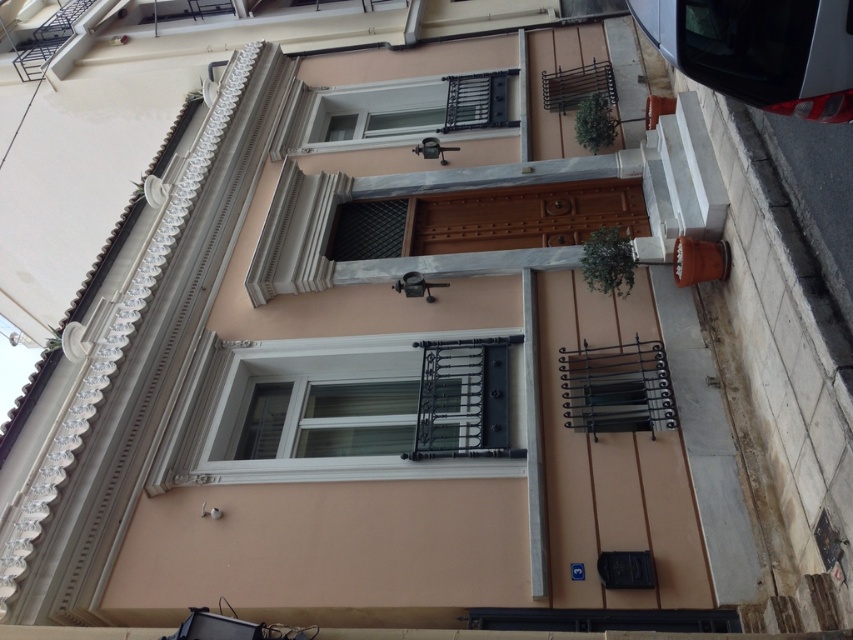
Is white matte window at center above white plastic window at upper center?

Incorrect, white matte window at center is not positioned above white plastic window at upper center.

From the picture: Can you confirm if white matte window at center is positioned to the right of white plastic window at upper center?

Incorrect, white matte window at center is not on the right side of white plastic window at upper center.

Which is in front, point (274, 481) or point (465, 113)?

Point (274, 481) is more forward.

This screenshot has width=853, height=640. What are the coordinates of `white matte window at center` in the screenshot? It's located at (354, 413).